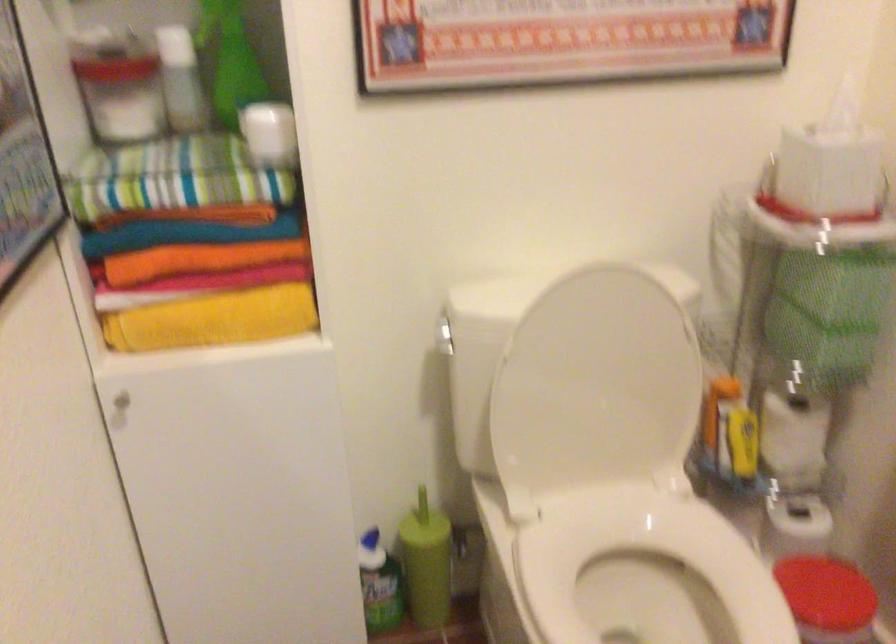
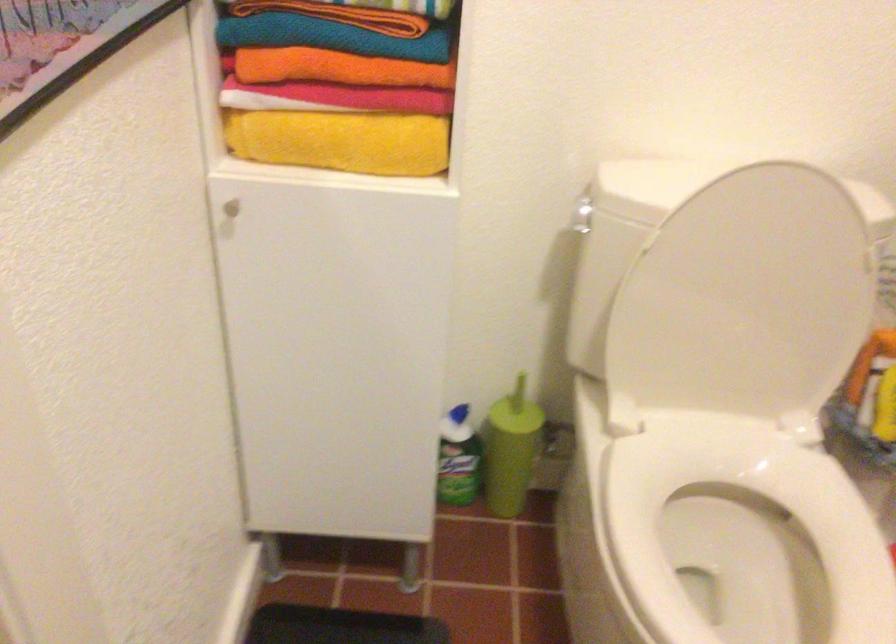
Where in the second image is the point corresponding to point 428,561 from the first image?

(511, 450)